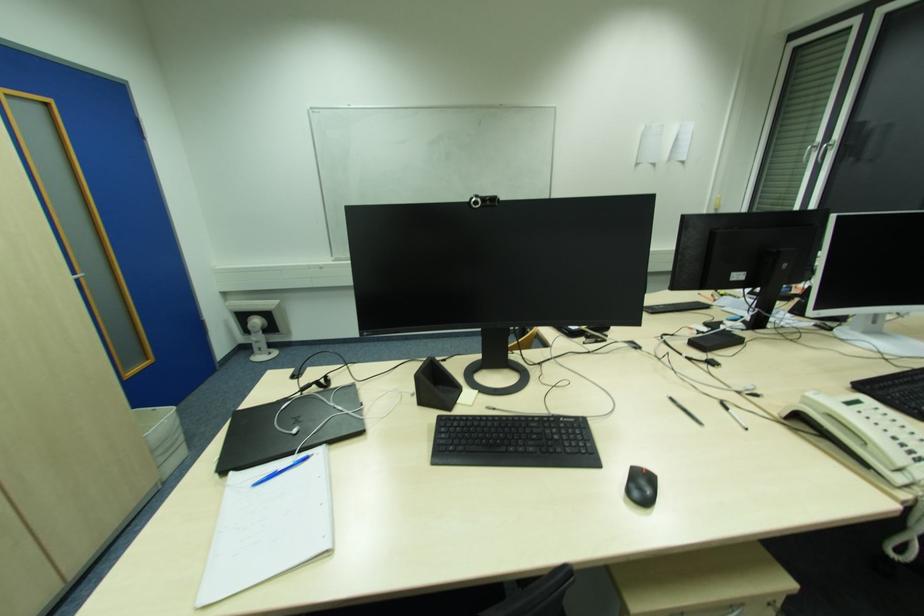
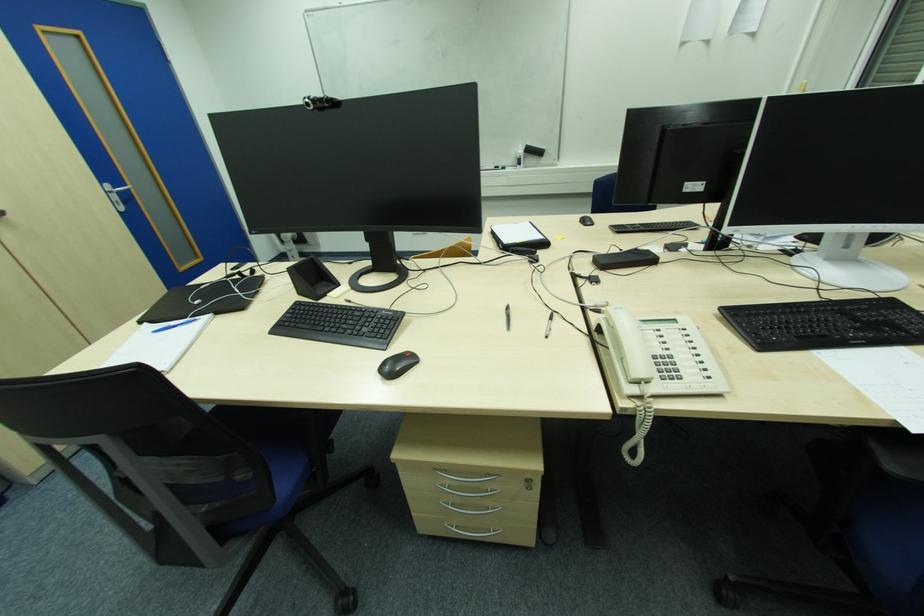
Locate, in the second image, the point that corresponds to point 675,400 in the first image.

(509, 309)